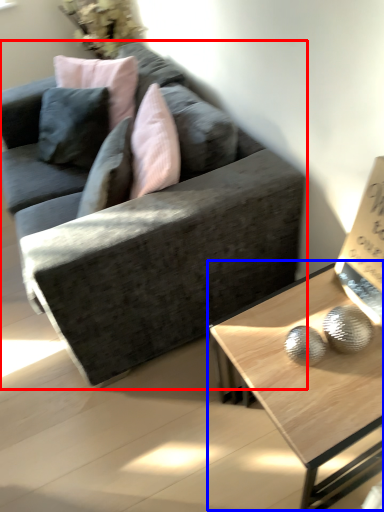
Question: Which object appears closest to the camera in this image, studio couch (highlighted by a red box) or coffee table (highlighted by a blue box)?

Choices:
 (A) studio couch
 (B) coffee table

Answer: (B)